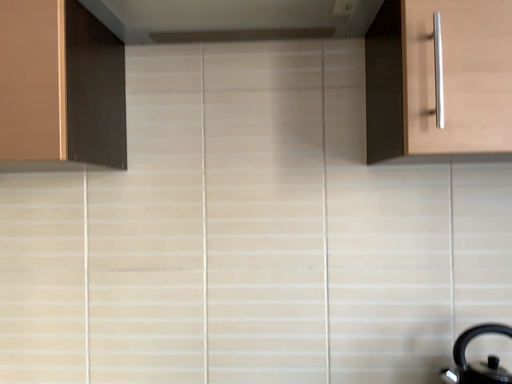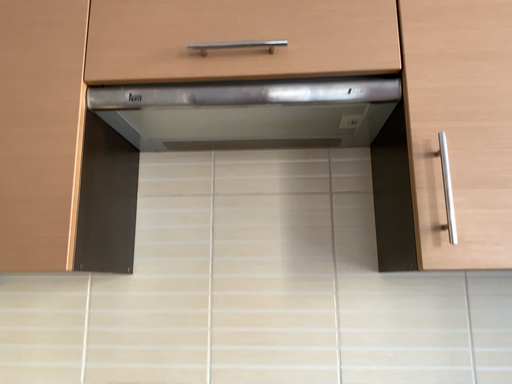
Question: Which way did the camera rotate in the video?

Choices:
 (A) rotated downward
 (B) rotated upward

Answer: (B)